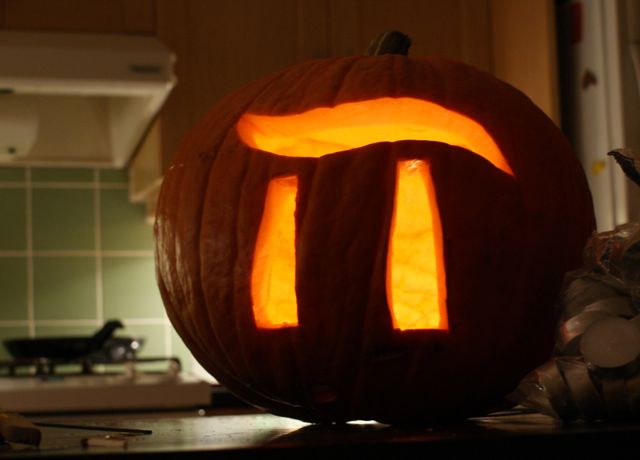
The image size is (640, 460). I want to click on cooking pan, so click(x=67, y=344).